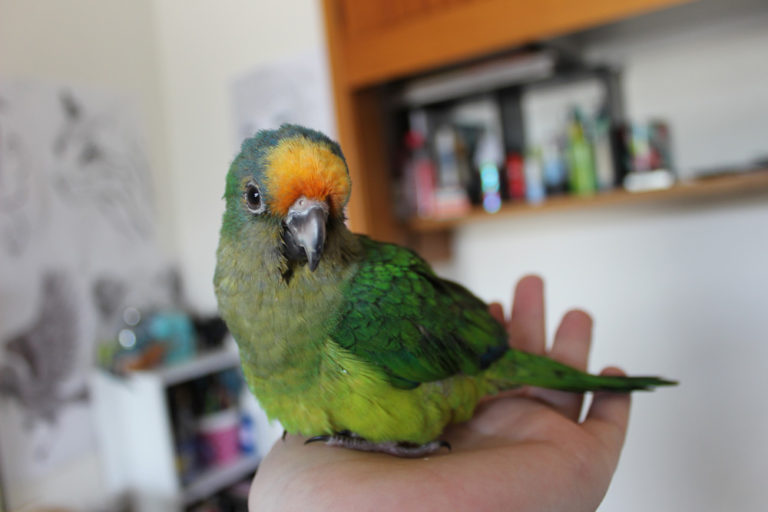
Find the location of a particular element. The height and width of the screenshot is (512, 768). cabinet door is located at coordinates (411, 13).